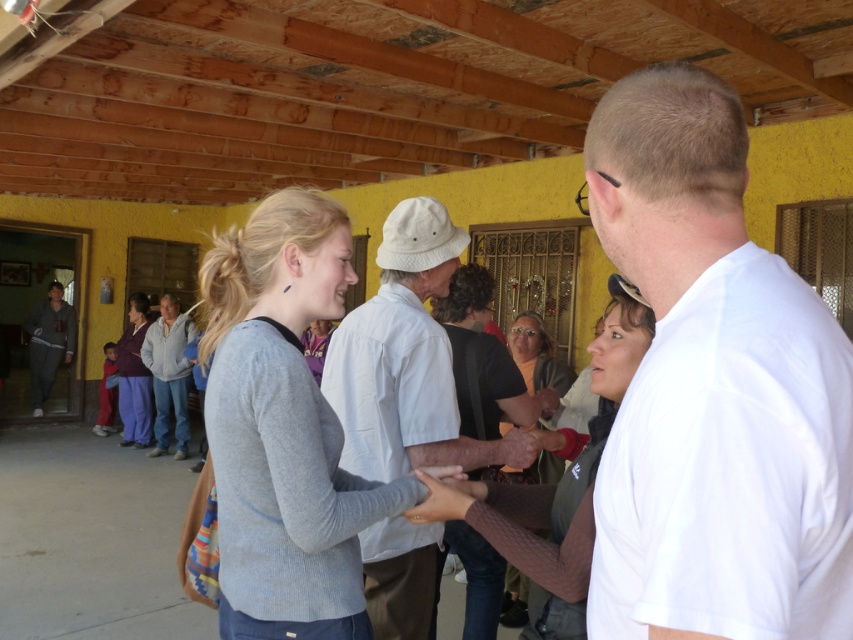
Where is `brown textured sweater at center`? brown textured sweater at center is located at coordinates (553, 490).

Is point (645, 340) more distant than point (556, 388)?

No.

You are a GUI agent. You are given a task and a screenshot of the screen. Output one action in this format:
    pyautogui.click(x=<x>, y=<y>)
    Task: Click on the brown textured sweater at center
    The width and height of the screenshot is (853, 640).
    Given the screenshot: What is the action you would take?
    pyautogui.click(x=553, y=490)

Who is taller, white matte shirt at center or matte gray sweater at center?

With more height is matte gray sweater at center.

Who is shorter, white matte shirt at center or matte gray sweater at center?

white matte shirt at center

Describe the element at coordinates (712, 390) in the screenshot. I see `white matte shirt at center` at that location.

The height and width of the screenshot is (640, 853). What are the coordinates of `white matte shirt at center` in the screenshot? It's located at (712, 390).

Which is below, matte gray sweater at center or gray sweatpants at left?

matte gray sweater at center is below.

The width and height of the screenshot is (853, 640). Describe the element at coordinates (479, 356) in the screenshot. I see `matte gray sweater at center` at that location.

At what (x,y) coordinates should I click in order to perform the action: click on matte gray sweater at center. Please return your answer as a coordinate pair (x, y). The height and width of the screenshot is (640, 853). Looking at the image, I should click on (479, 356).